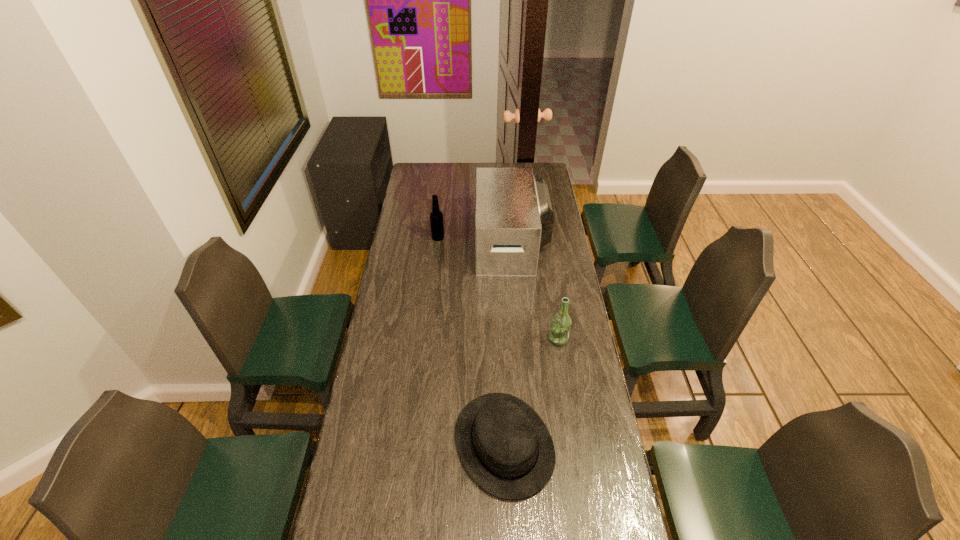
This screenshot has height=540, width=960. I want to click on vacant area situated on the right of the farther beer bottle, so click(x=479, y=238).

You are a GUI agent. You are given a task and a screenshot of the screen. Output one action in this format:
    pyautogui.click(x=<x>, y=<y>)
    Task: Click on the vacant space located 0.300m on the surface of the nearer beer bottle
    This screenshot has width=960, height=540.
    Given the screenshot: What is the action you would take?
    pyautogui.click(x=471, y=339)

I want to click on free space located on the surface of the nearer beer bottle, so click(x=494, y=339).

What are the coordinates of `vacant space located 0.170m on the surface of the nearer beer bottle` in the screenshot? It's located at (505, 339).

The height and width of the screenshot is (540, 960). What are the coordinates of `vacant space situated on the back of the nearest object` in the screenshot? It's located at (501, 364).

What are the coordinates of `microwave oven at the right edge` in the screenshot? It's located at (514, 218).

Identify the location of beer bottle that is at the right edge. (560, 327).

Find the location of a particular element. The image size is (960, 540). vacant area at the far edge of the desktop is located at coordinates (442, 164).

Where is `free spot at the left edge of the desktop`? This screenshot has height=540, width=960. free spot at the left edge of the desktop is located at coordinates (361, 485).

Find the location of a particular element. free spot at the right edge of the desktop is located at coordinates (597, 491).